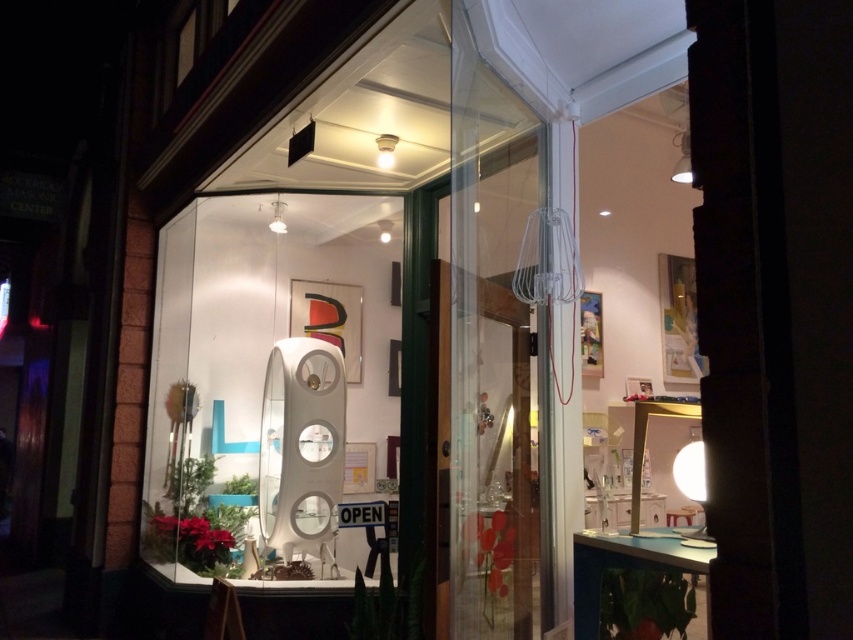
Question: Which point is closer to the camera taking this photo?

Choices:
 (A) (486, 109)
 (B) (195, 541)

Answer: (A)

Question: Does white glossy mirror at center have a smaller size compared to transparent glass door at center?

Choices:
 (A) yes
 (B) no

Answer: (B)

Question: From the image, what is the correct spatial relationship of white glossy mirror at center in relation to transparent glass door at center?

Choices:
 (A) below
 (B) above

Answer: (A)

Question: Which of the following is the farthest from the observer?

Choices:
 (A) transparent glass door at center
 (B) white glossy mirror at center

Answer: (B)

Question: Observing the image, what is the correct spatial positioning of white glossy mirror at center in reference to transparent glass door at center?

Choices:
 (A) above
 (B) below

Answer: (B)

Question: Which point is farther from the camera taking this photo?

Choices:
 (A) (505, 157)
 (B) (233, 380)

Answer: (B)